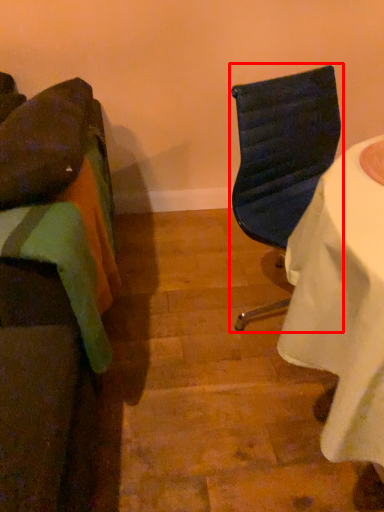
Question: From the image, what is the correct spatial relationship of chair (annotated by the red box) in relation to chair?

Choices:
 (A) left
 (B) right

Answer: (B)